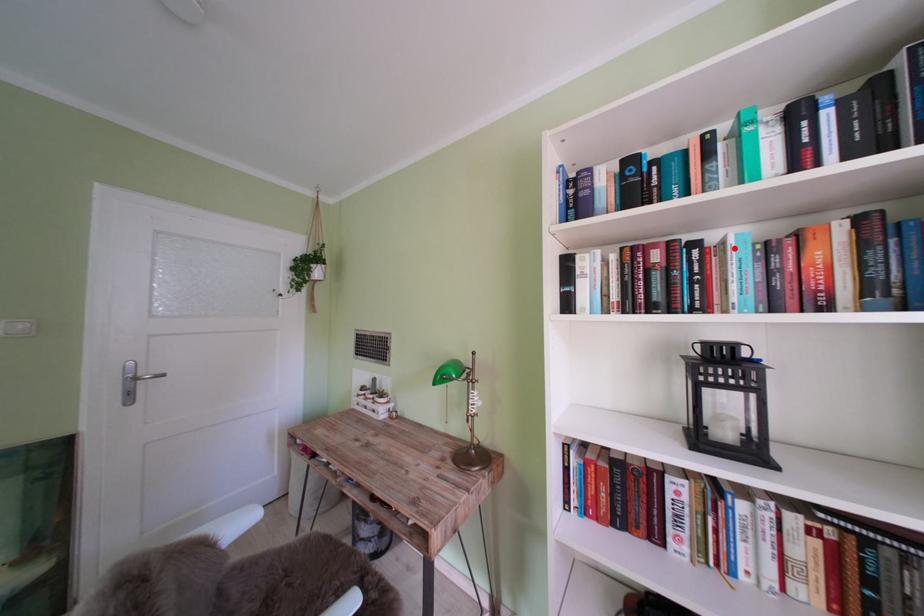
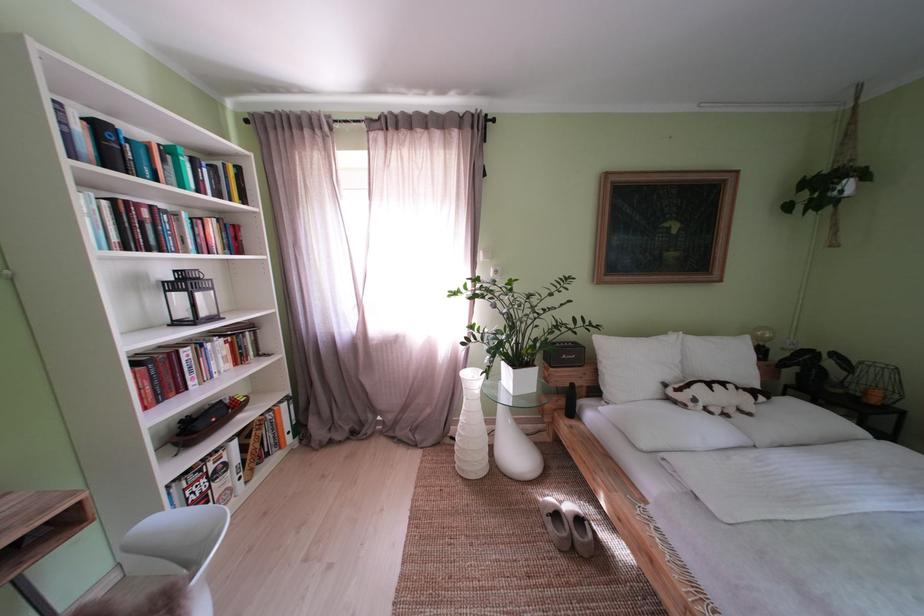
In the second image, find the point that corresponds to the highlighted location in the first image.

(188, 220)